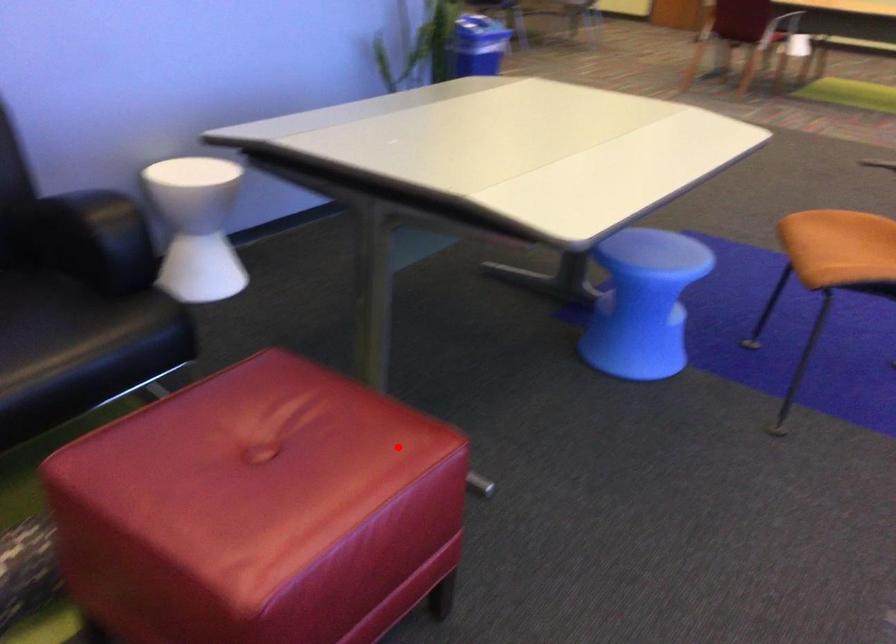
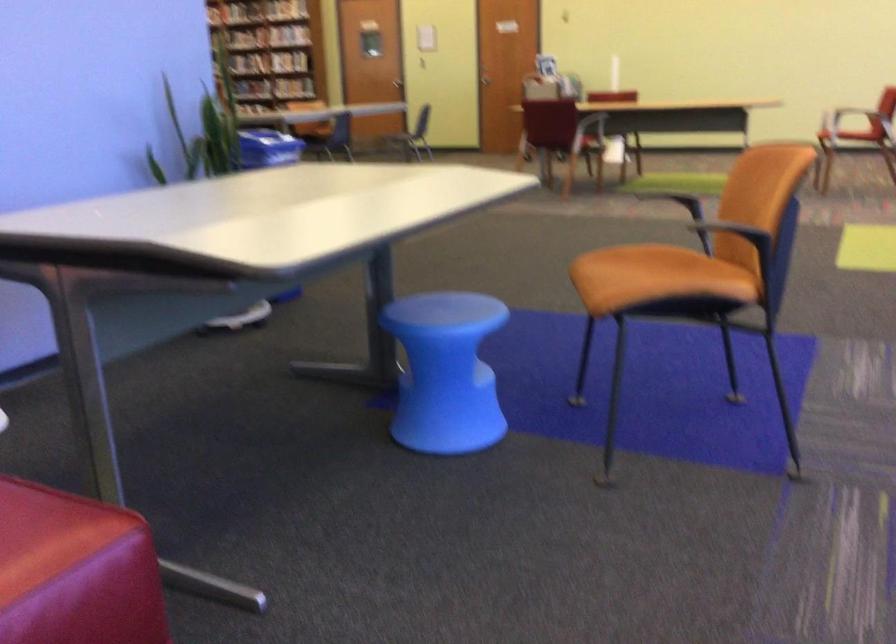
Question: I am providing you with two images of the same scene from different viewpoints. Given a red point in image1, look at the same physical point in image2. Is it:

Choices:
 (A) Closer to the viewpoint
 (B) Farther from the viewpoint

Answer: (A)